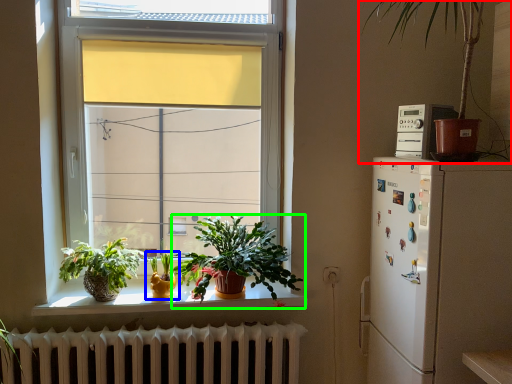
Question: Which object is positioned farthest from houseplant (highlighted by a red box)? Select from houseplant (highlighted by a blue box) and houseplant (highlighted by a green box).

Choices:
 (A) houseplant
 (B) houseplant

Answer: (A)